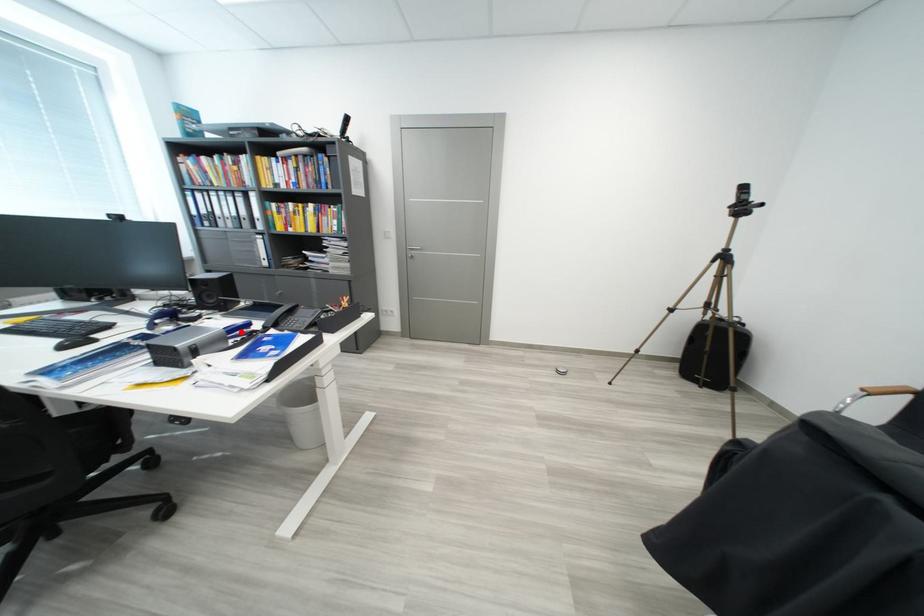
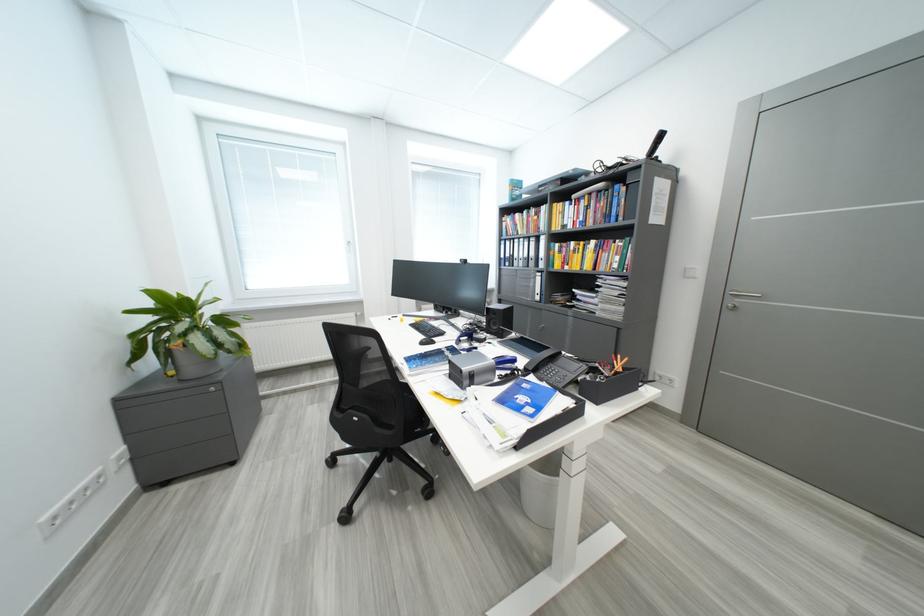
The point at the highlighted location is marked in the first image. Where is the corresponding point in the second image?

(511, 363)